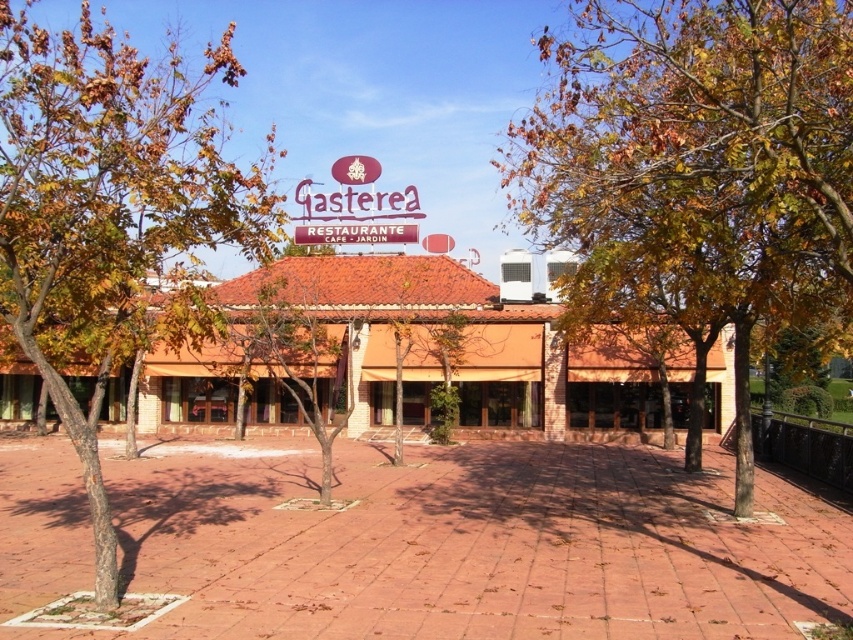
Does yellow-green foliage at center have a larger size compared to brown bark tree at center?

Indeed, yellow-green foliage at center has a larger size compared to brown bark tree at center.

Which is behind, point (606, 93) or point (270, 273)?

Positioned behind is point (270, 273).

Who is more distant from viewer, (755, 4) or (238, 332)?

Positioned behind is point (238, 332).

Find the location of a particular element. yellow-green foliage at center is located at coordinates (701, 156).

In the scene shown: Measure the distance between brown leafy tree at left and brown bark tree at center.

brown leafy tree at left and brown bark tree at center are 7.22 meters apart from each other.

Does point (97, 218) come in front of point (276, 300)?

Yes, it is.

Identify the location of brown leafy tree at left. (105, 205).

What do you see at coordinates (701, 156) in the screenshot? The height and width of the screenshot is (640, 853). I see `yellow-green foliage at center` at bounding box center [701, 156].

Who is more distant from viewer, (737, 163) or (36, 136)?

The point (36, 136) is more distant.

Between point (622, 198) and point (119, 212), which one is positioned in front?

Point (119, 212)

Image resolution: width=853 pixels, height=640 pixels. What are the coordinates of `yellow-green foliage at center` in the screenshot? It's located at (701, 156).